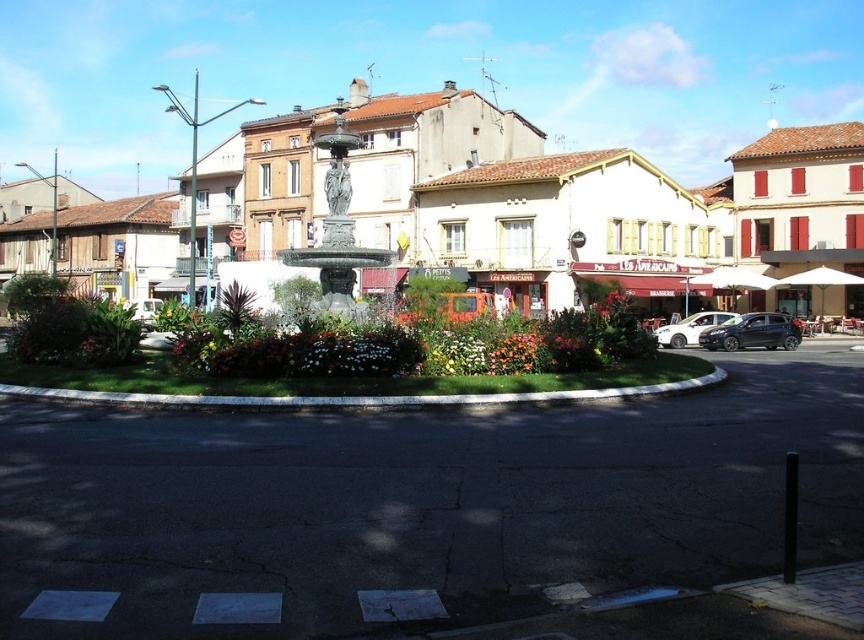
Question: Can you confirm if black matte hatchback at right is positioned to the right of satin silver sedan at right?

Choices:
 (A) no
 (B) yes

Answer: (B)

Question: Is green marble fountain at center closer to the viewer compared to satin silver sedan at right?

Choices:
 (A) yes
 (B) no

Answer: (A)

Question: Which point appears farthest from the camera in this image?

Choices:
 (A) (677, 346)
 (B) (511, 349)
 (C) (354, 138)

Answer: (A)

Question: Which object appears farthest from the camera in this image?

Choices:
 (A) polished stone fountain at center
 (B) green marble fountain at center
 (C) satin silver sedan at right
 (D) floral bouquet at center

Answer: (A)

Question: Which object appears closest to the camera in this image?

Choices:
 (A) black matte hatchback at right
 (B) polished stone fountain at center
 (C) green marble fountain at center
 (D) floral bouquet at center

Answer: (D)

Question: Can you confirm if green marble fountain at center is positioned to the right of satin silver sedan at right?

Choices:
 (A) no
 (B) yes

Answer: (A)